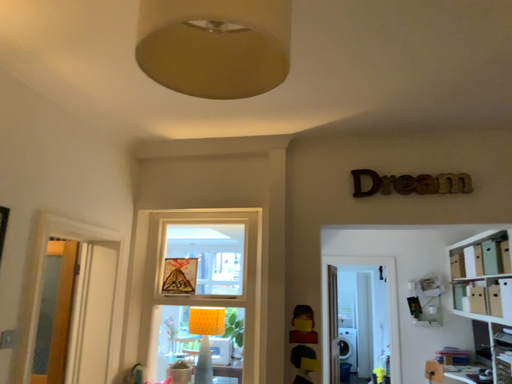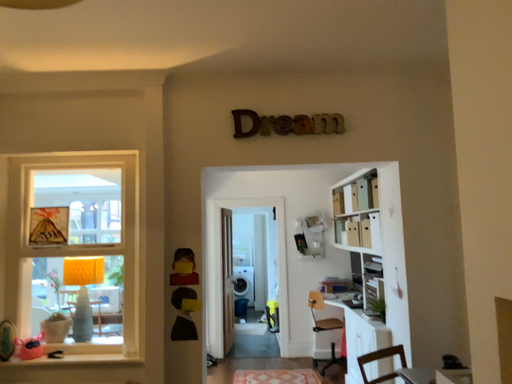
Question: Which way did the camera rotate in the video?

Choices:
 (A) rotated left
 (B) rotated right

Answer: (B)